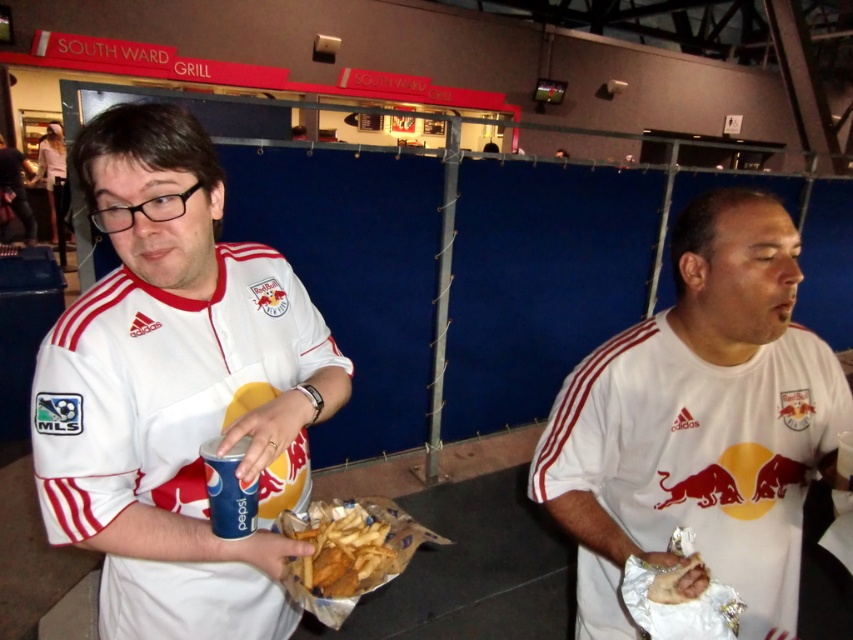
You are a photographer at the soccer match and need to capture a clear shot of both the white matte shirt at center and the golden crispy fries at center. Since the camera can only focus on one subject at a time, which object should you focus on to ensure the other remains in the background?

The white matte shirt at center is located above the golden crispy fries at center, so focusing on the white matte shirt at center will keep the golden crispy fries at center in the background.

You are a photographer at the soccer event. You need to capture a closeup shot of the golden crispy fries at center without the white matte shirt at center blocking the view. Is the shirt wider than the fries?

The white matte shirt at center is wider than the golden crispy fries at center, so the shirt may block the view of the fries if positioned too close.

You are a photographer at the soccer event. You need to capture a photo where the white matte jersey at center and the blue paper cup at left are both clearly visible. Based on their sizes, which object should you focus on first to ensure it is in frame?

The white matte jersey at center is taller than the blue paper cup at left, so you should focus on the white matte jersey at center first to ensure it is in frame since it is larger and more prominent.